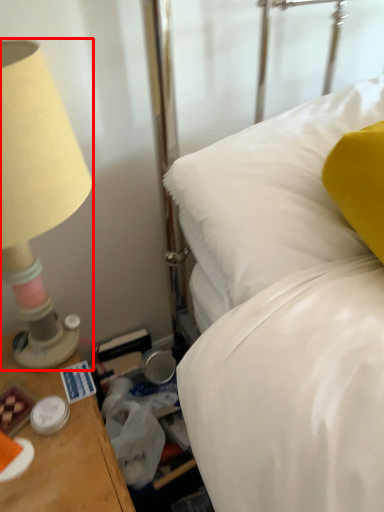
Question: Where is lamp (annotated by the red box) located in relation to bed in the image?

Choices:
 (A) right
 (B) left

Answer: (B)